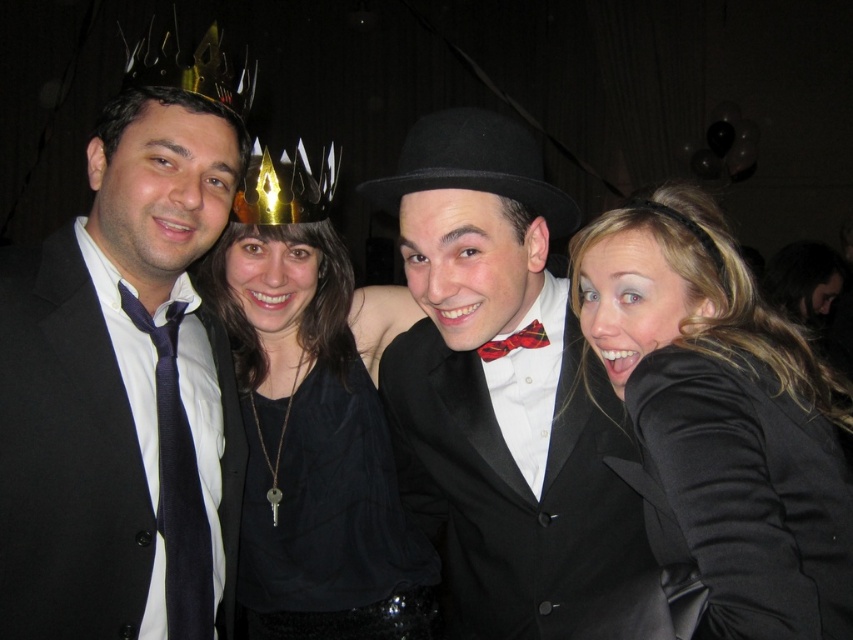
Question: Which object is positioned closest to the plaid fabric bow tie at center?

Choices:
 (A) smooth black jacket at center
 (B) matte black suit at left
 (C) black fabric shirt at center

Answer: (A)

Question: Which of the following is the closest to the observer?

Choices:
 (A) (x=309, y=237)
 (B) (x=815, y=620)
 (C) (x=120, y=582)

Answer: (B)

Question: Is smooth black jacket at center thinner than matte black tie at left?

Choices:
 (A) no
 (B) yes

Answer: (A)

Question: Which is farther from the plaid fabric bow tie at center?

Choices:
 (A) matte black suit at left
 (B) black fabric shirt at center

Answer: (A)

Question: Does matte black suit at left have a lesser width compared to matte black tie at left?

Choices:
 (A) yes
 (B) no

Answer: (B)

Question: Is the position of black fabric shirt at center more distant than that of matte black suit at left?

Choices:
 (A) no
 (B) yes

Answer: (B)